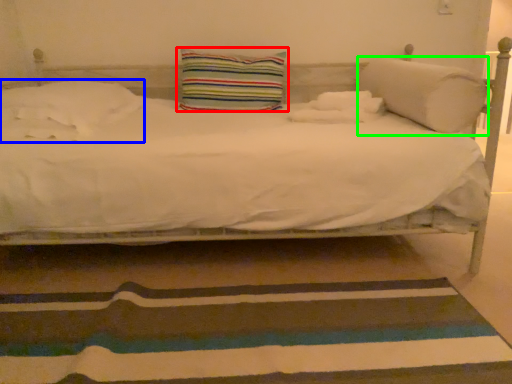
Question: Which object is positioned closest to pillow (highlighted by a red box)? Select from pillow (highlighted by a blue box) and pillow (highlighted by a green box).

Choices:
 (A) pillow
 (B) pillow

Answer: (A)